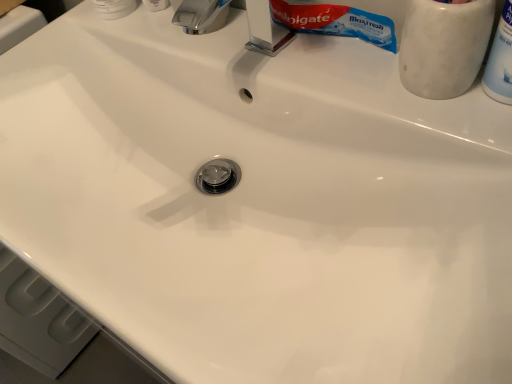
Question: Is white plastic bottle at upper right, marked as the third toiletry in a left-to-right arrangement, to the right of chrome metallic faucet at upper center from the viewer's perspective?

Choices:
 (A) yes
 (B) no

Answer: (A)

Question: From a real-world perspective, is white plastic bottle at upper right, marked as the third toiletry in a left-to-right arrangement, under chrome metallic faucet at upper center?

Choices:
 (A) yes
 (B) no

Answer: (B)

Question: Is white plastic bottle at upper right, which is counted as the first toiletry, starting from the right, surrounding chrome metallic faucet at upper center?

Choices:
 (A) yes
 (B) no

Answer: (B)

Question: Does white plastic bottle at upper right, marked as the third toiletry in a left-to-right arrangement, have a greater height compared to chrome metallic faucet at upper center?

Choices:
 (A) no
 (B) yes

Answer: (B)

Question: Can you confirm if white plastic bottle at upper right, which is counted as the first toiletry, starting from the right, is shorter than chrome metallic faucet at upper center?

Choices:
 (A) yes
 (B) no

Answer: (B)

Question: Is chrome metallic faucet at upper center at the back of white plastic bottle at upper right, marked as the third toiletry in a left-to-right arrangement?

Choices:
 (A) no
 (B) yes

Answer: (A)

Question: From a real-world perspective, is white plastic toothpaste tube at upper left, arranged as the 3th toiletry when viewed from the right, below chrome metallic faucet at upper center?

Choices:
 (A) yes
 (B) no

Answer: (A)

Question: Can you confirm if white plastic toothpaste tube at upper left, which ranks as the first toiletry in left-to-right order, is bigger than chrome metallic faucet at upper center?

Choices:
 (A) yes
 (B) no

Answer: (B)

Question: Considering the relative sizes of white plastic toothpaste tube at upper left, which ranks as the first toiletry in left-to-right order, and chrome metallic faucet at upper center in the image provided, is white plastic toothpaste tube at upper left, which ranks as the first toiletry in left-to-right order, smaller than chrome metallic faucet at upper center?

Choices:
 (A) no
 (B) yes

Answer: (B)

Question: Is white plastic toothpaste tube at upper left, arranged as the 3th toiletry when viewed from the right, at the left side of chrome metallic faucet at upper center?

Choices:
 (A) yes
 (B) no

Answer: (A)

Question: Considering the relative positions of white plastic toothpaste tube at upper left, arranged as the 3th toiletry when viewed from the right, and chrome metallic faucet at upper center in the image provided, is white plastic toothpaste tube at upper left, arranged as the 3th toiletry when viewed from the right, to the right of chrome metallic faucet at upper center from the viewer's perspective?

Choices:
 (A) yes
 (B) no

Answer: (B)

Question: Could you tell me if white plastic toothpaste tube at upper left, which ranks as the first toiletry in left-to-right order, is facing chrome metallic faucet at upper center?

Choices:
 (A) no
 (B) yes

Answer: (A)

Question: Is the depth of white marble toothbrush holder at upper right, which ranks as the second toiletry in right-to-left order, greater than that of white plastic bottle at upper right, marked as the third toiletry in a left-to-right arrangement?

Choices:
 (A) yes
 (B) no

Answer: (A)